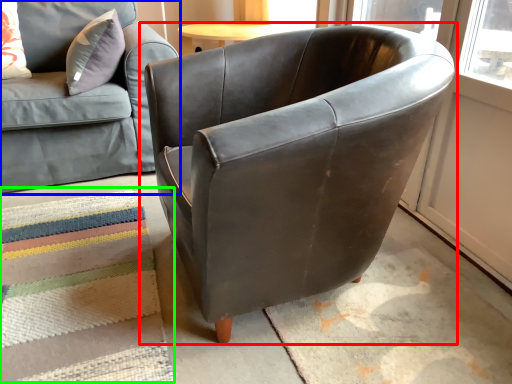
Question: Based on their relative distances, which object is farther from chair (highlighted by a red box)? Choose from studio couch (highlighted by a blue box) and mat (highlighted by a green box).

Choices:
 (A) studio couch
 (B) mat

Answer: (A)